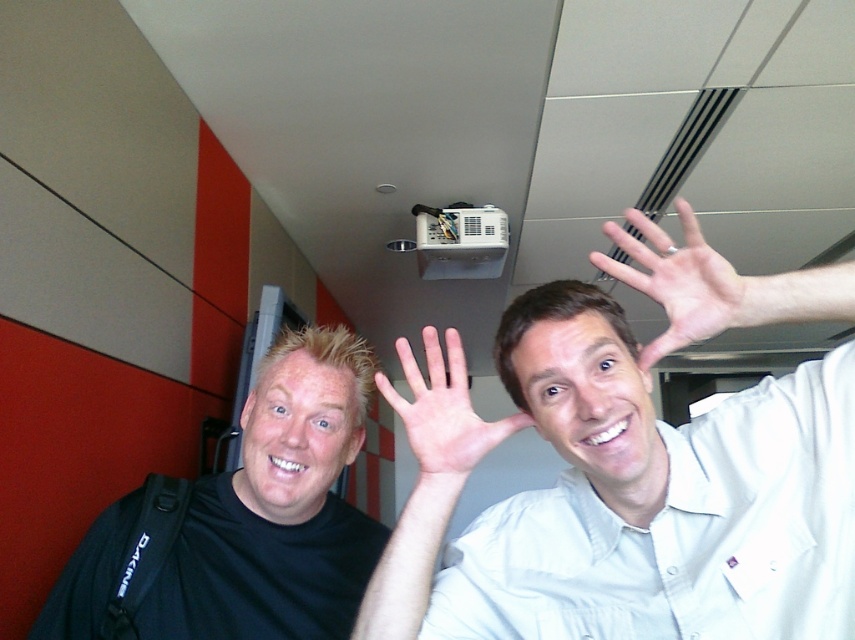
You are a photographer standing in the hallway. You want to position a spotlight at point [684,282] to highlight the waving hand of the person on the right. According to the image, is the white matte hand at upper right located at that point?

Yes, the white matte hand at upper right is located at point [684,282], so the spotlight should be placed there to highlight it.

You are standing in the hallway and need to locate the white glossy projector at upper center. According to the coordinates provided, where exactly is it positioned?

The white glossy projector at upper center is located at point coordinates of (634, 470).

You are standing in a hallway and want to take a photo of the white glossy projector at upper center without the black matte shirt at left blocking the view. Can you adjust your position to achieve this?

The white glossy projector at upper center is closer to the viewer than the black matte shirt at left, so moving closer to the projector or shifting your angle might allow you to position yourself where the black matte shirt at left does not block the projector.